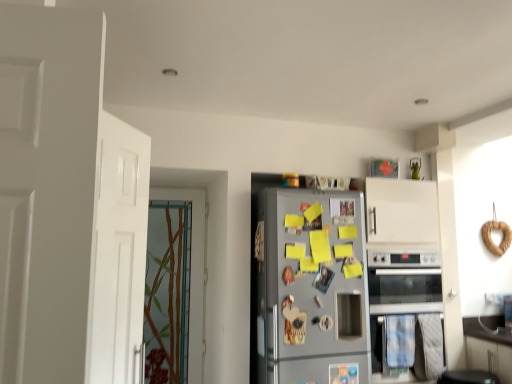
You are a GUI agent. You are given a task and a screenshot of the screen. Output one action in this format:
    pyautogui.click(x=<x>, y=<y>)
    Task: Click on the blank space above translucent glass door at left, the second door from the front (from a real-world perspective)
    The image size is (512, 384).
    Given the screenshot: What is the action you would take?
    point(174,185)